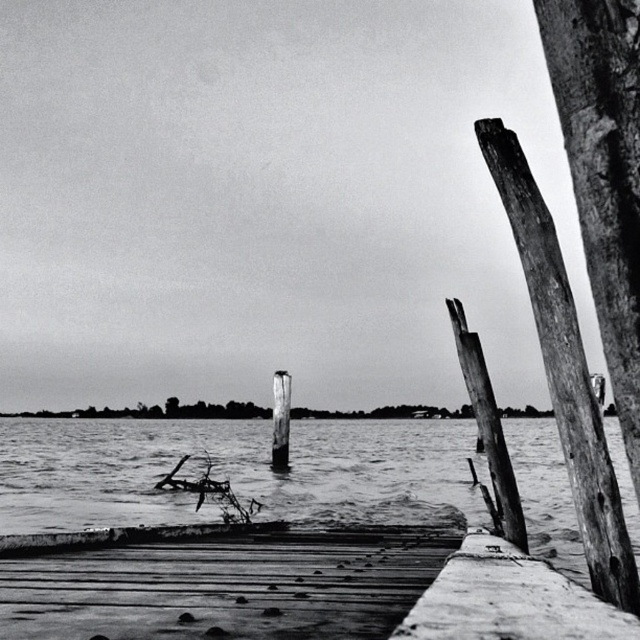
Does smooth wood dock at lower center have a greater height compared to wooden post at right?

→ In fact, smooth wood dock at lower center may be shorter than wooden post at right.

Which is more to the left, smooth wood dock at lower center or wooden post at right?

From the viewer's perspective, smooth wood dock at lower center appears more on the left side.

Which is behind, point (433, 536) or point (488, 408)?

Point (433, 536)

Where is `smooth wood dock at lower center`? This screenshot has height=640, width=640. smooth wood dock at lower center is located at coordinates (298, 582).

Between smooth wood dock at lower center and smooth water at center, which one is positioned lower?

Positioned lower is smooth water at center.

Is point (484, 627) closer to camera compared to point (548, 486)?

Yes.

Identify the location of smooth wood dock at lower center. The height and width of the screenshot is (640, 640). (298, 582).

Can you confirm if smooth wood dock at lower center is shorter than weathered wood post at right?

Yes, smooth wood dock at lower center is shorter than weathered wood post at right.

Does smooth wood dock at lower center have a larger size compared to weathered wood post at right?

Indeed, smooth wood dock at lower center has a larger size compared to weathered wood post at right.

Locate an element on the screen. The image size is (640, 640). smooth wood dock at lower center is located at coordinates click(298, 582).